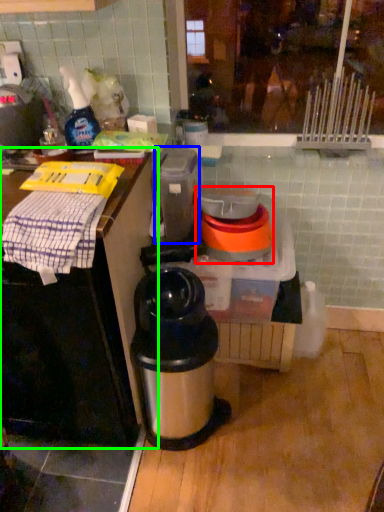
Question: Which is farther away from appliance (highlighted by a red box)? appliance (highlighted by a blue box) or table (highlighted by a green box)?

Choices:
 (A) appliance
 (B) table

Answer: (B)